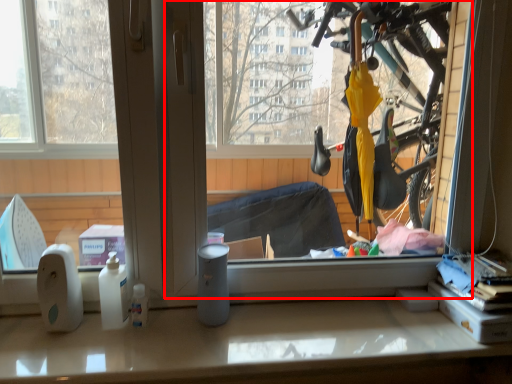
Question: From the image's perspective, where is window screen (annotated by the red box) located relative to counter top?

Choices:
 (A) above
 (B) below

Answer: (A)